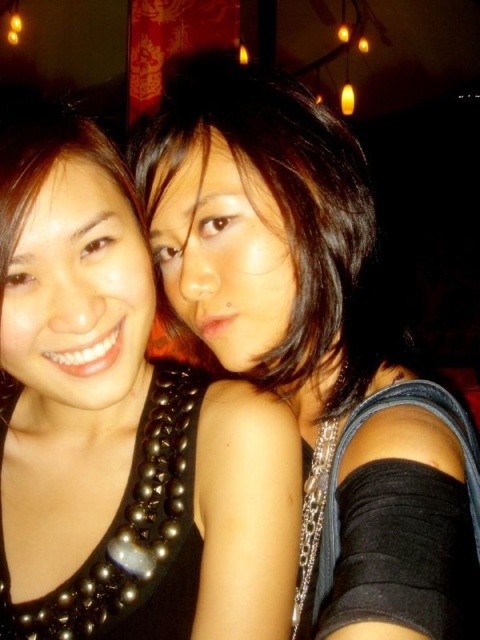
Question: Is black pearl necklace at center further to the viewer compared to black beaded necklace at upper left?

Choices:
 (A) yes
 (B) no

Answer: (A)

Question: Among these points, which one is nearest to the camera?

Choices:
 (A) (346, 566)
 (B) (220, 460)

Answer: (A)

Question: Does black pearl necklace at center appear over black beaded necklace at upper left?

Choices:
 (A) no
 (B) yes

Answer: (A)

Question: Can you confirm if black pearl necklace at center is positioned to the left of black beaded necklace at upper left?

Choices:
 (A) no
 (B) yes

Answer: (B)

Question: Which of the following is the closest to the observer?

Choices:
 (A) black pearl necklace at center
 (B) black beaded necklace at upper left

Answer: (B)